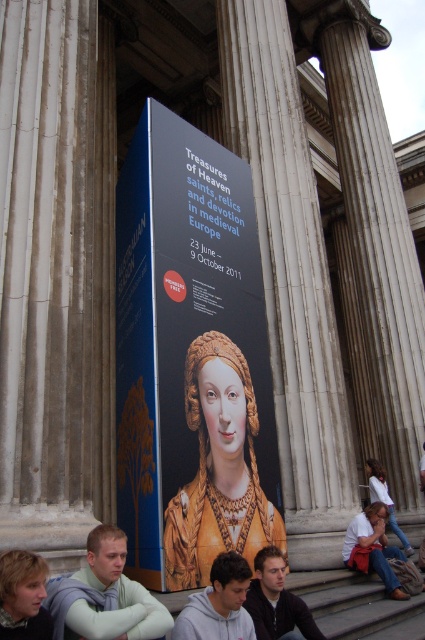
Question: Does smooth stone pillar at center lie behind blonde hair at lower left?

Choices:
 (A) no
 (B) yes

Answer: (B)

Question: Based on their relative distances, which object is farther from the gray hoodie at center?

Choices:
 (A) matte gold necklace at lower center
 (B) smooth stone pillar at center
 (C) dark brown leather jacket at lower center
 (D) blonde hair at lower left

Answer: (B)

Question: Is gray hoodie at center smaller than blonde hair at lower left?

Choices:
 (A) yes
 (B) no

Answer: (B)

Question: Which object is positioned farthest from the matte gold necklace at lower center?

Choices:
 (A) matte black poster at center
 (B) gray hoodie at center
 (C) smooth stone pillar at center

Answer: (B)

Question: Estimate the real-world distances between objects in this image. Which object is closer to the matte black poster at center?

Choices:
 (A) smooth stone pillar at center
 (B) gray hoodie at center
 (C) light green sweater at lower left
 (D) white cotton shirt at lower right

Answer: (A)

Question: Does gray hoodie at center have a lesser width compared to dark brown leather jacket at lower center?

Choices:
 (A) no
 (B) yes

Answer: (B)